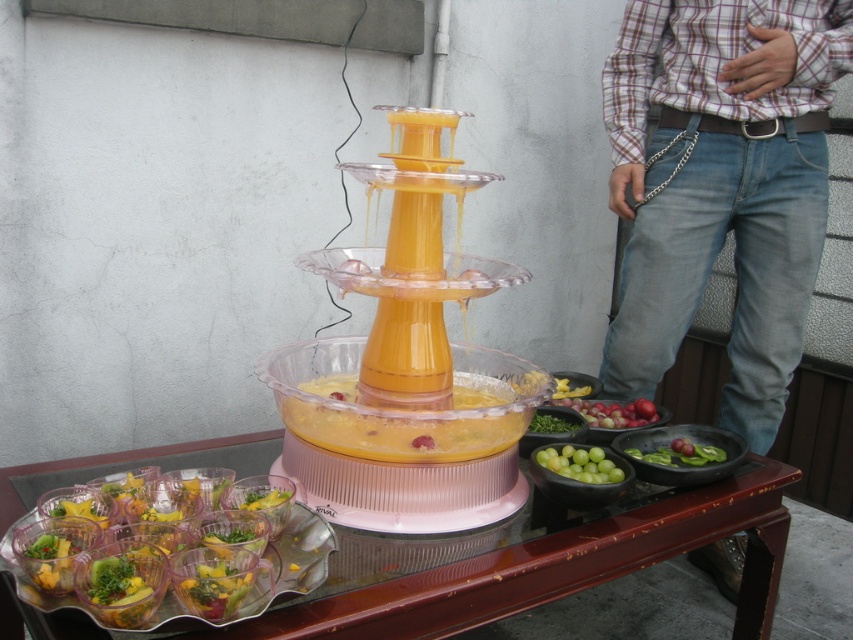
You are at a party and want to grab a drink. You see the translucent plastic cups at lower left and the green leafy vegetables at center. Which item is closer to the floor?

The translucent plastic cups at lower left are closer to the floor since they are located below the green leafy vegetables at center.

You are a caterer setting up a party. You have a pair of denim jeans at right. You need to place them so that they are exactly 6 feet away from the multi tiered orange juicer. Can you do it?

Yes, the denim jeans at right are already exactly 6.03 feet away from the multi tiered orange juicer, so they are within the required distance.